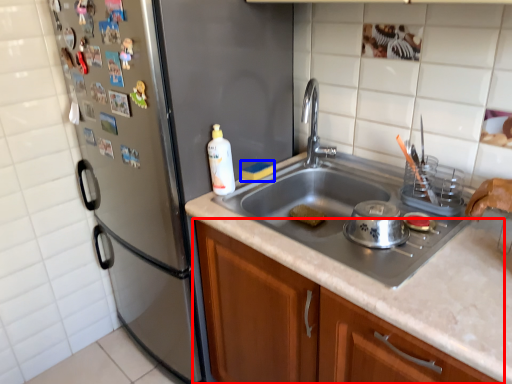
Question: Which of the following is the closest to the observer, cabinetry (highlighted by a red box) or food (highlighted by a blue box)?

Choices:
 (A) cabinetry
 (B) food

Answer: (A)